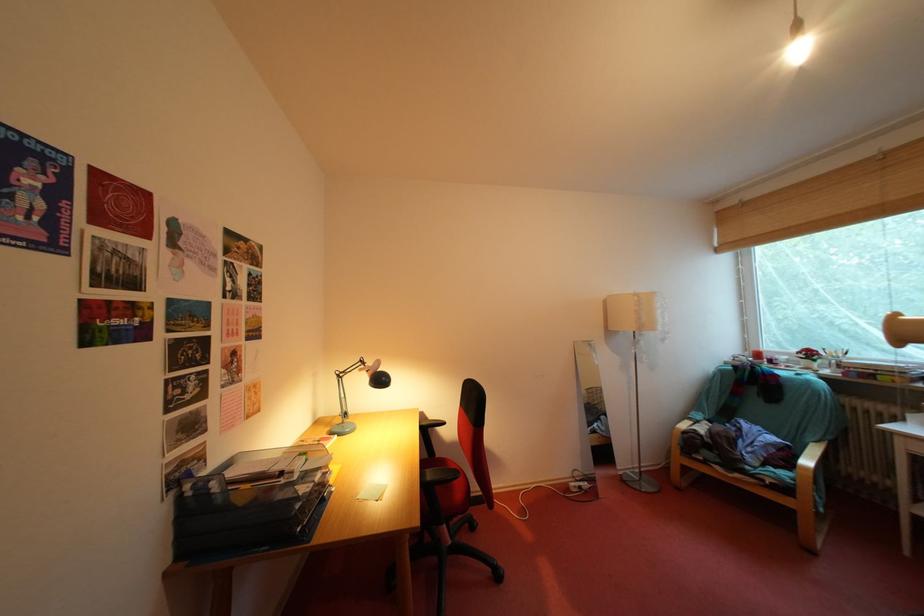
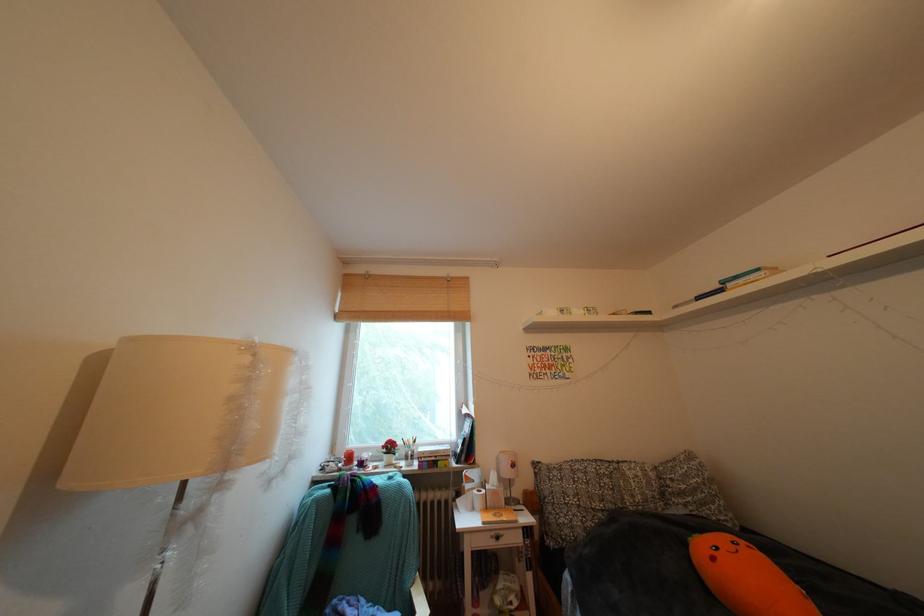
Find the pixel in the second image that matches point (754, 209) in the first image.

(379, 282)